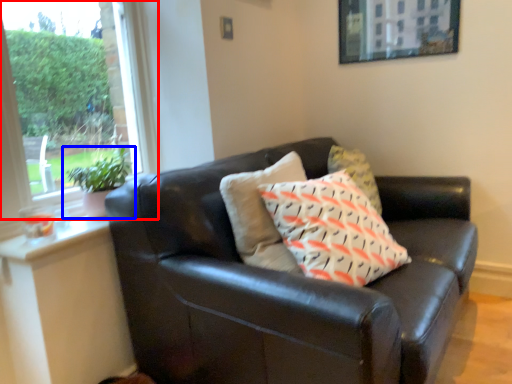
Question: Which of the following is the closest to the observer, window (highlighted by a red box) or houseplant (highlighted by a blue box)?

Choices:
 (A) window
 (B) houseplant

Answer: (A)